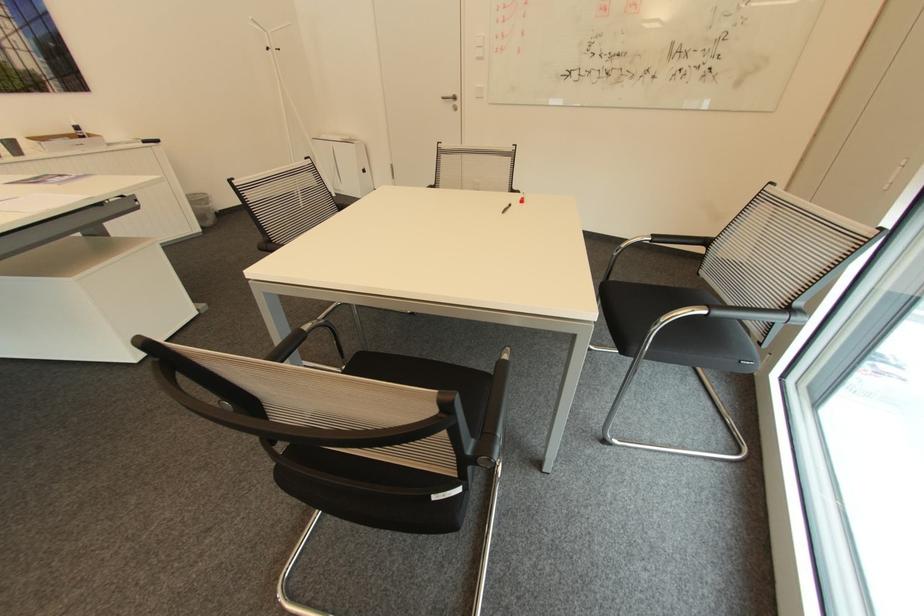
Find where to lift the white cardboard box. Please return your answer as a coordinate pair (x, y).

(343, 164)